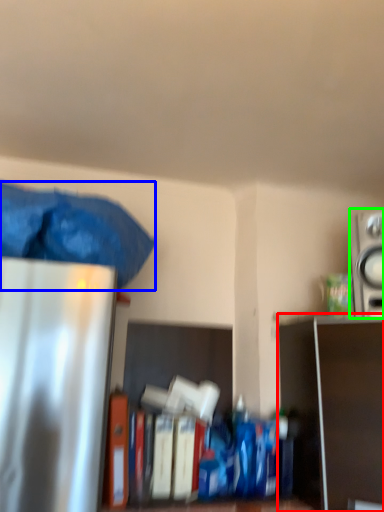
Question: Estimate the real-world distances between objects in this image. Which object is farther from shelf (highlighted by a red box), waste (highlighted by a blue box) or appliance (highlighted by a green box)?

Choices:
 (A) waste
 (B) appliance

Answer: (A)